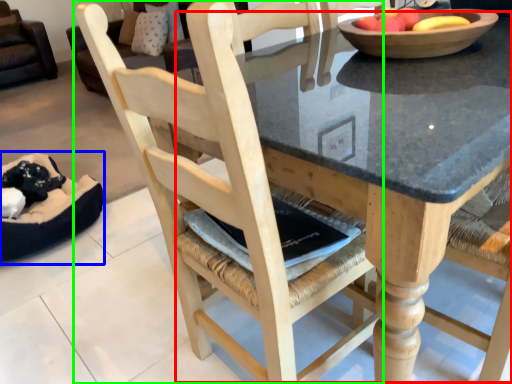
Question: Estimate the real-world distances between objects in this image. Which object is closer to round table (highlighted by a red box), bean bag chair (highlighted by a blue box) or chair (highlighted by a green box)?

Choices:
 (A) bean bag chair
 (B) chair

Answer: (B)